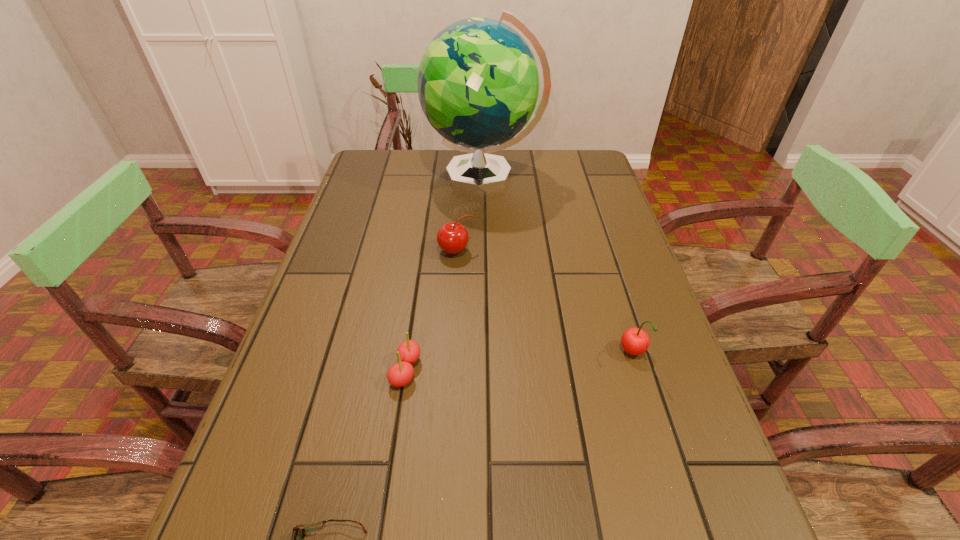
At what (x,y) coordinates should I click in order to perform the action: click on free location that satisfies the following two spatial constraints: 1. on the front surface of the globe; 2. on the front side of the second shortest object. Please return your answer as a coordinate pair (x, y). This screenshot has width=960, height=540. Looking at the image, I should click on (486, 370).